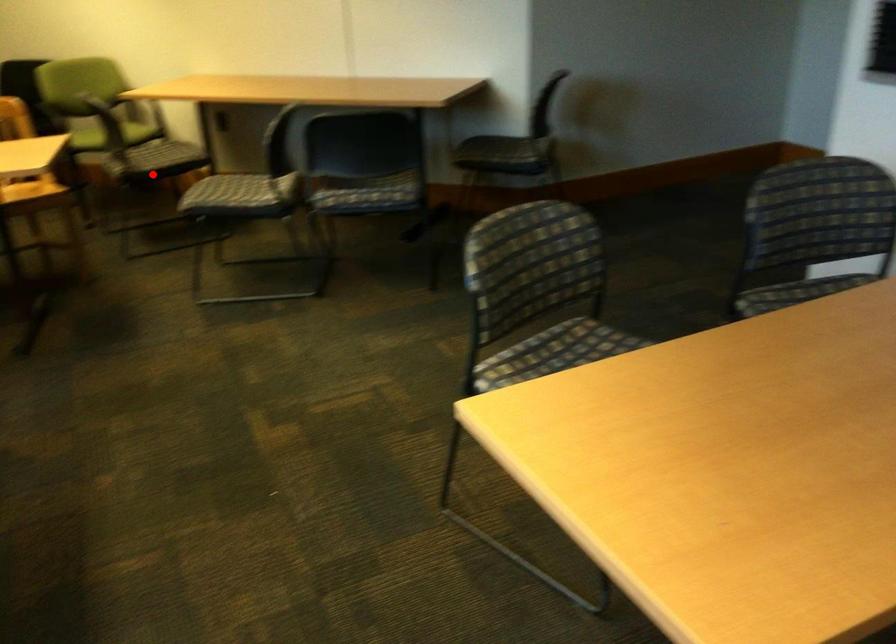
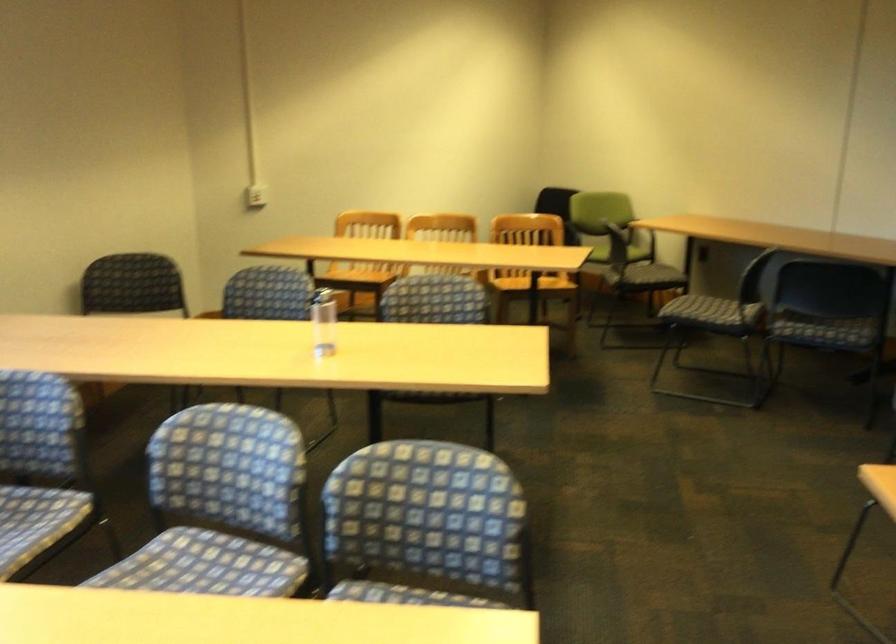
The point at the highlighted location is marked in the first image. Where is the corresponding point in the second image?

(643, 277)